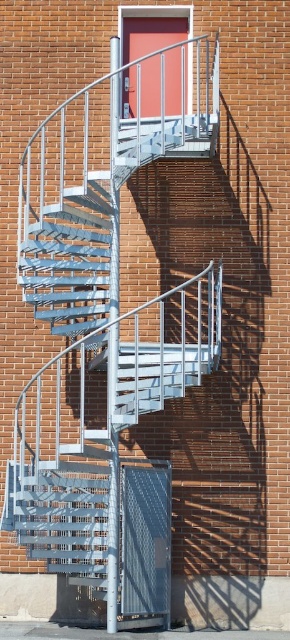
Question: Which point is closer to the camera taking this photo?

Choices:
 (A) (28, 176)
 (B) (58, 227)

Answer: (B)

Question: Does metallic silver fire escape at center have a smaller size compared to metallic silver staircase at center?

Choices:
 (A) yes
 (B) no

Answer: (B)

Question: Can you confirm if metallic silver fire escape at center is positioned above metallic silver staircase at center?

Choices:
 (A) yes
 (B) no

Answer: (B)

Question: Does metallic silver fire escape at center come behind metallic silver staircase at center?

Choices:
 (A) no
 (B) yes

Answer: (A)